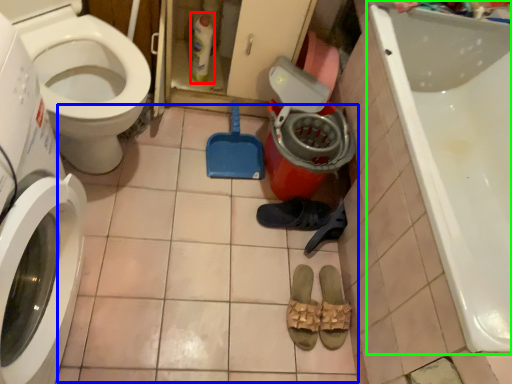
Question: Which is farther away from cleaning product (highlighted by a red box)? tile (highlighted by a blue box) or bathtub (highlighted by a green box)?

Choices:
 (A) tile
 (B) bathtub

Answer: (B)